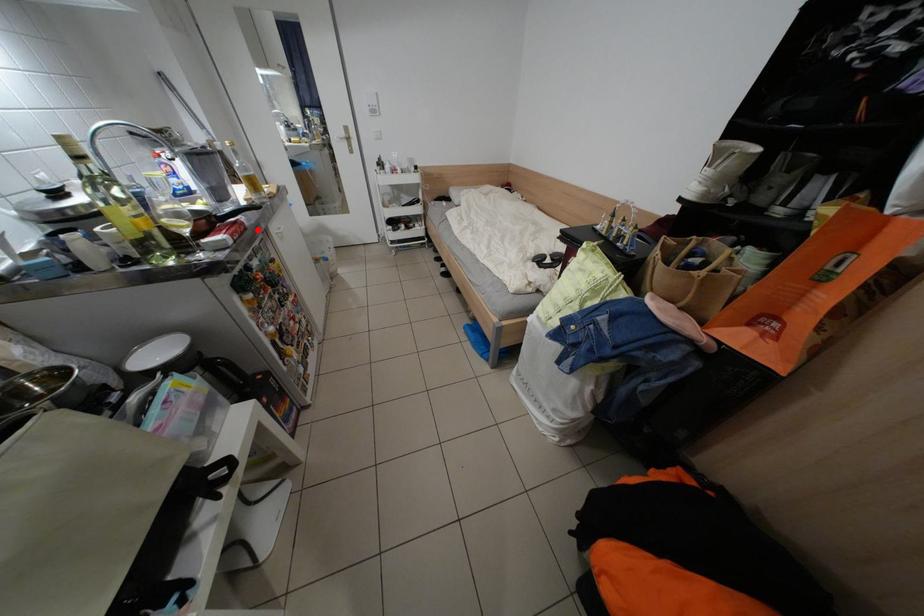
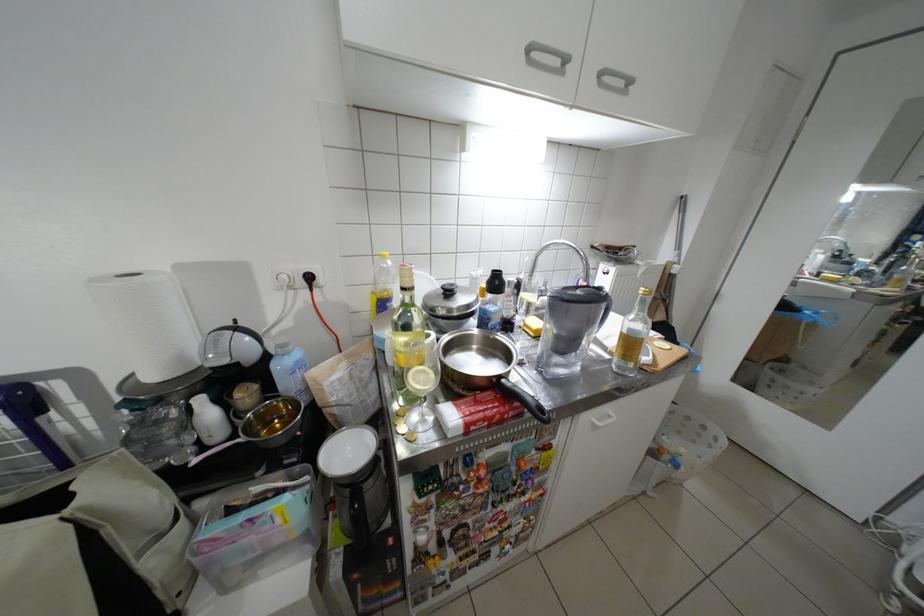
Question: A red point is marked in image1. In image2, is the corresponding 3D point closer to the camera or farther? Reply with the corresponding letter.

Choices:
 (A) The corresponding 3D point is closer.
 (B) The corresponding 3D point is farther.

Answer: (B)